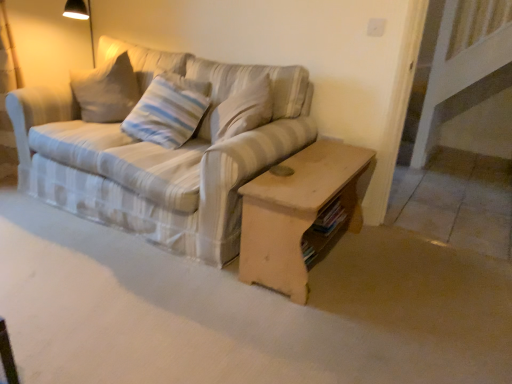
Question: Considering the relative sizes of striped fabric pillow at center and wooden coffee table at center in the image provided, is striped fabric pillow at center smaller than wooden coffee table at center?

Choices:
 (A) no
 (B) yes

Answer: (B)

Question: From the image's perspective, is striped fabric pillow at center on top of wooden coffee table at center?

Choices:
 (A) no
 (B) yes

Answer: (B)

Question: Is the position of striped fabric pillow at center less distant than that of wooden coffee table at center?

Choices:
 (A) no
 (B) yes

Answer: (A)

Question: Is striped fabric pillow at center wider than wooden coffee table at center?

Choices:
 (A) no
 (B) yes

Answer: (A)

Question: Does striped fabric pillow at center appear on the left side of wooden coffee table at center?

Choices:
 (A) no
 (B) yes

Answer: (B)

Question: From a real-world perspective, is striped fabric pillow at center located beneath wooden coffee table at center?

Choices:
 (A) yes
 (B) no

Answer: (B)

Question: Is striped fabric couch at center positioned beyond the bounds of wooden coffee table at center?

Choices:
 (A) yes
 (B) no

Answer: (A)

Question: From the image's perspective, is striped fabric couch at center above wooden coffee table at center?

Choices:
 (A) yes
 (B) no

Answer: (A)

Question: Is striped fabric couch at center bigger than wooden coffee table at center?

Choices:
 (A) yes
 (B) no

Answer: (A)

Question: Considering the relative positions of striped fabric couch at center and wooden coffee table at center in the image provided, is striped fabric couch at center to the right of wooden coffee table at center from the viewer's perspective?

Choices:
 (A) yes
 (B) no

Answer: (B)

Question: Can wooden coffee table at center be found inside striped fabric couch at center?

Choices:
 (A) no
 (B) yes

Answer: (A)

Question: Does striped fabric couch at center have a greater height compared to wooden coffee table at center?

Choices:
 (A) yes
 (B) no

Answer: (A)

Question: Is striped fabric couch at center bigger than striped fabric pillow at center?

Choices:
 (A) no
 (B) yes

Answer: (B)